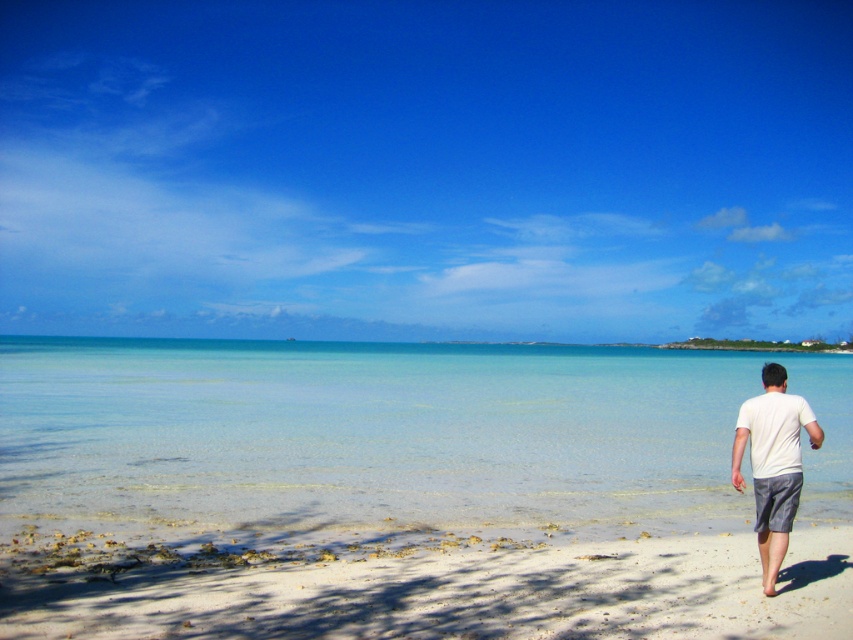
Question: Which object is closer to the camera taking this photo?

Choices:
 (A) gray cotton shorts at lower right
 (B) clear water at lower center
 (C) white cotton t-shirt at right

Answer: (C)

Question: Estimate the real-world distances between objects in this image. Which object is closer to the gray cotton shorts at lower right?

Choices:
 (A) clear water at lower center
 (B) white sandy beach at lower right

Answer: (B)

Question: Estimate the real-world distances between objects in this image. Which object is closer to the white sandy beach at lower right?

Choices:
 (A) clear water at lower center
 (B) white cotton t-shirt at right

Answer: (B)

Question: Can you confirm if white cotton t-shirt at right is thinner than gray cotton shorts at lower right?

Choices:
 (A) no
 (B) yes

Answer: (A)

Question: Observing the image, what is the correct spatial positioning of white sandy beach at lower right in reference to white cotton t-shirt at right?

Choices:
 (A) right
 (B) left

Answer: (B)

Question: Is clear water at lower center above gray cotton shorts at lower right?

Choices:
 (A) no
 (B) yes

Answer: (A)